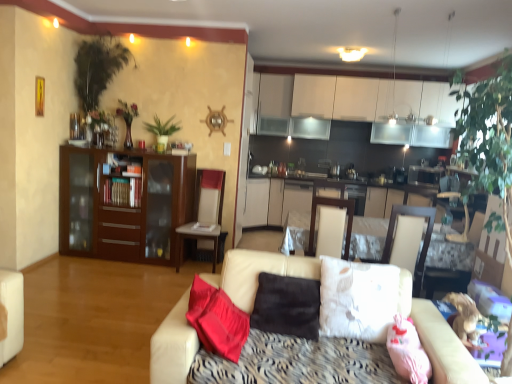
Question: Considering the relative sizes of white leather chair at center and brown suede pillow at center, which is the second pillow from right to left, in the image provided, is white leather chair at center wider than brown suede pillow at center, which is the second pillow from right to left,?

Choices:
 (A) yes
 (B) no

Answer: (A)

Question: Is white leather chair at center positioned in front of brown suede pillow at center, which is the second pillow from right to left?

Choices:
 (A) no
 (B) yes

Answer: (A)

Question: From a real-world perspective, does white leather chair at center sit lower than brown suede pillow at center, which is the second pillow from right to left?

Choices:
 (A) yes
 (B) no

Answer: (A)

Question: Is white leather chair at center at the left side of brown suede pillow at center, the first pillow viewed from the left?

Choices:
 (A) no
 (B) yes

Answer: (B)

Question: Considering the relative sizes of white leather chair at center and brown suede pillow at center, the first pillow viewed from the left, in the image provided, is white leather chair at center bigger than brown suede pillow at center, the first pillow viewed from the left,?

Choices:
 (A) yes
 (B) no

Answer: (A)

Question: Is white leather chair at center spatially inside brown suede pillow at center, the first pillow viewed from the left, or outside of it?

Choices:
 (A) inside
 (B) outside

Answer: (B)

Question: In terms of size, does white leather chair at center appear bigger or smaller than brown suede pillow at center, which is the second pillow from right to left?

Choices:
 (A) big
 (B) small

Answer: (A)

Question: Would you say white leather chair at center is to the left or to the right of brown suede pillow at center, which is the second pillow from right to left, in the picture?

Choices:
 (A) right
 (B) left

Answer: (B)

Question: From the image's perspective, is white leather chair at center positioned above or below brown suede pillow at center, which is the second pillow from right to left?

Choices:
 (A) above
 (B) below

Answer: (A)

Question: Would you say white leather armchair at center is to the left or to the right of brown wood cabinet at left in the picture?

Choices:
 (A) left
 (B) right

Answer: (B)

Question: In the image, is white leather armchair at center positioned in front of or behind brown wood cabinet at left?

Choices:
 (A) front
 (B) behind

Answer: (A)

Question: From a real-world perspective, is white leather armchair at center positioned above or below brown wood cabinet at left?

Choices:
 (A) below
 (B) above

Answer: (B)

Question: Considering the positions of white leather armchair at center and brown wood cabinet at left in the image, is white leather armchair at center wider or thinner than brown wood cabinet at left?

Choices:
 (A) wide
 (B) thin

Answer: (A)

Question: Is green leafy plant at upper center bigger or smaller than brown suede pillow at center, the first pillow viewed from the left?

Choices:
 (A) big
 (B) small

Answer: (B)

Question: Considering the relative positions of green leafy plant at upper center and brown suede pillow at center, the first pillow viewed from the left, in the image provided, is green leafy plant at upper center to the left or to the right of brown suede pillow at center, the first pillow viewed from the left,?

Choices:
 (A) left
 (B) right

Answer: (A)